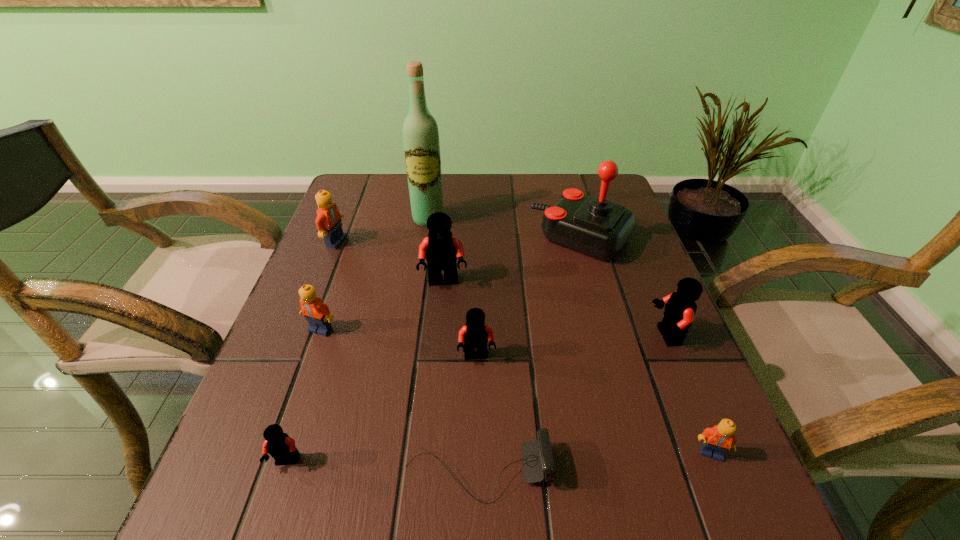
You are a GUI agent. You are given a task and a screenshot of the screen. Output one action in this format:
    pyautogui.click(x=<x>, y=<y>)
    Task: Click on the tallest object
    The width and height of the screenshot is (960, 540).
    Given the screenshot: What is the action you would take?
    pyautogui.click(x=421, y=143)

Locate an element on the screen. The height and width of the screenshot is (540, 960). wine bottle is located at coordinates (421, 143).

Find the location of a particular element. joystick is located at coordinates (595, 226).

Where is `the ninth shortest object`? the ninth shortest object is located at coordinates (595, 226).

I want to click on the third tallest object, so click(x=441, y=249).

Identify the location of the sixth nearest Lego. The width and height of the screenshot is (960, 540). (441, 249).

Locate an element on the screen. This screenshot has width=960, height=540. the farthest Lego is located at coordinates coord(328,221).

The image size is (960, 540). Identify the location of the farthest orange Lego. (328, 221).

At what (x,y) coordinates should I click in order to perform the action: click on the rightmost black Lego. Please return your answer as a coordinate pair (x, y). This screenshot has width=960, height=540. Looking at the image, I should click on (680, 308).

Locate an element on the screen. This screenshot has height=540, width=960. the second biggest orange Lego is located at coordinates (317, 314).